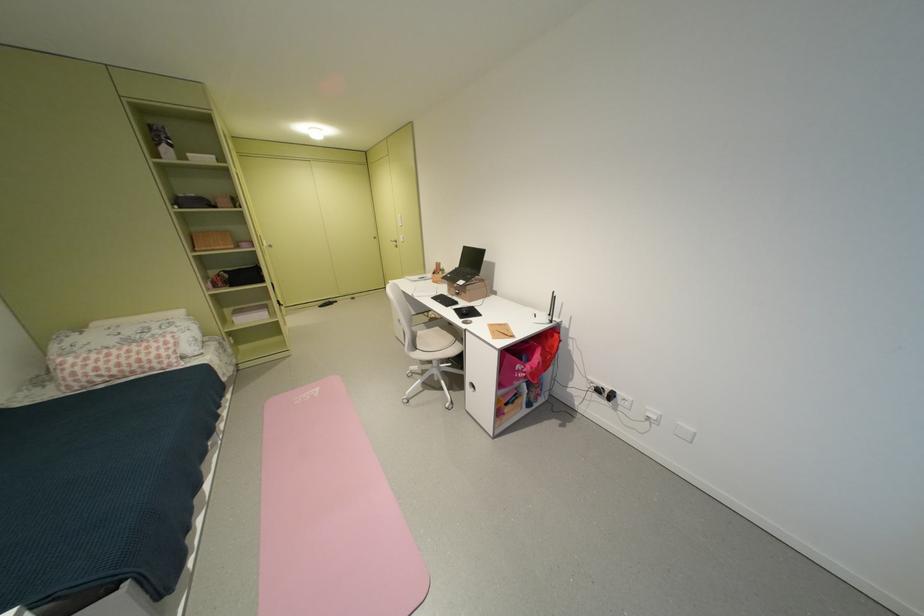
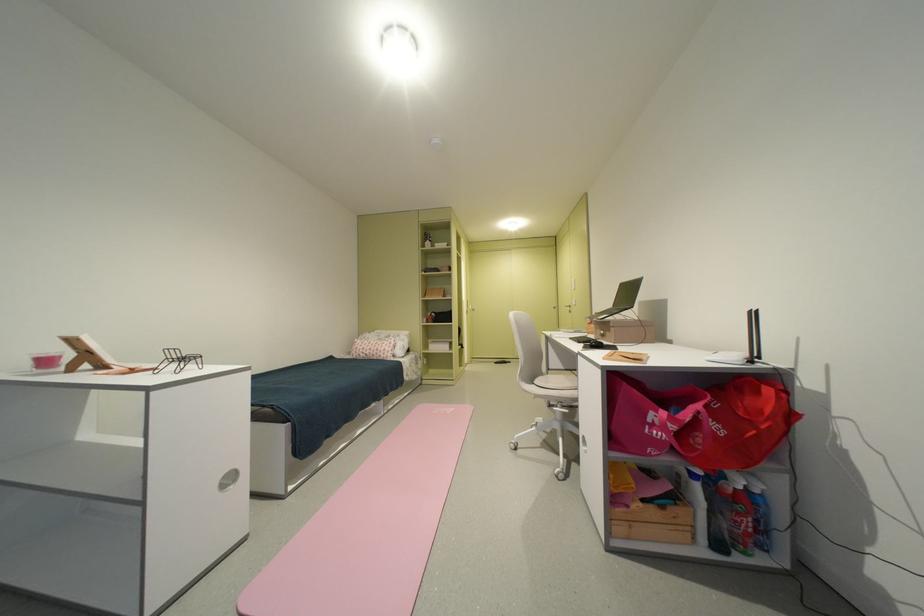
Find the pixel in the second image that matches (x=546, y=389) in the first image.

(755, 519)